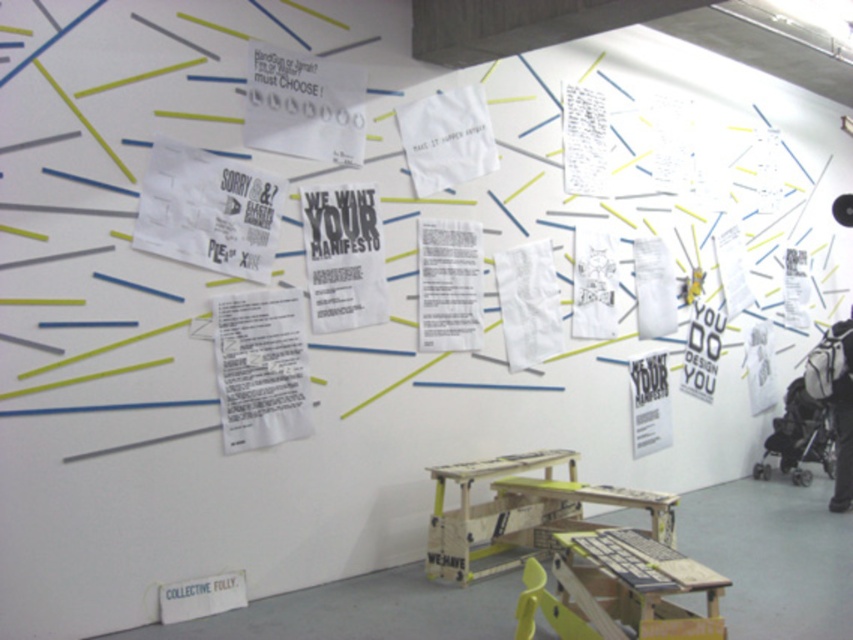
Question: Which point appears closest to the camera in this image?

Choices:
 (A) [x=422, y=161]
 (B) [x=514, y=282]

Answer: (A)

Question: Does white paper at upper center appear under white paper at center?

Choices:
 (A) no
 (B) yes

Answer: (A)

Question: Does white paper at upper center appear on the right side of white paper at center?

Choices:
 (A) yes
 (B) no

Answer: (B)

Question: Observing the image, what is the correct spatial positioning of white paper at upper center in reference to white paper at center?

Choices:
 (A) left
 (B) right

Answer: (A)

Question: Which of the following is the closest to the observer?

Choices:
 (A) (547, 349)
 (B) (450, 99)

Answer: (B)